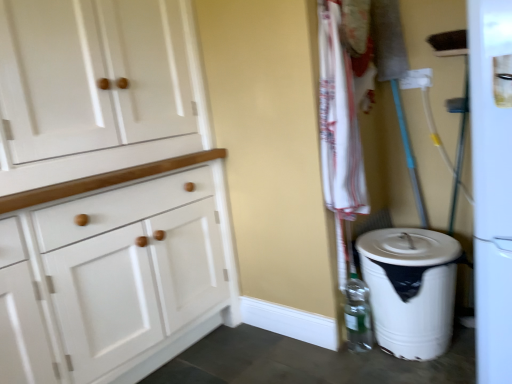
Question: From a real-world perspective, is white cotton towel at center-right above or below clear plastic bottle at lower right?

Choices:
 (A) above
 (B) below

Answer: (A)

Question: Based on their positions, is white cotton towel at center-right located to the left or right of clear plastic bottle at lower right?

Choices:
 (A) right
 (B) left

Answer: (B)

Question: Which of these objects is positioned farthest from the white wood cabinet at left?

Choices:
 (A) white cotton towel at center-right
 (B) clear plastic bottle at lower right
 (C) white plastic trash can at lower right

Answer: (B)

Question: Which of these objects is positioned closest to the clear plastic bottle at lower right?

Choices:
 (A) white plastic trash can at lower right
 (B) white wood cabinet at left
 (C) white cotton towel at center-right

Answer: (A)